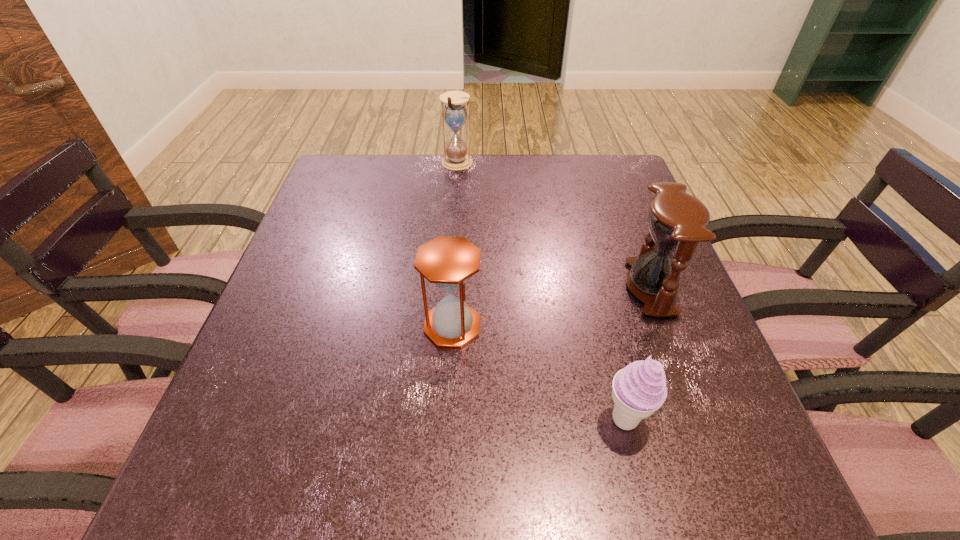
Image resolution: width=960 pixels, height=540 pixels. I want to click on hourglass at the right edge, so click(x=677, y=221).

Identify the location of icecream that is positioned at the right edge. The width and height of the screenshot is (960, 540). (639, 389).

Where is `free location at the far edge of the desktop`? free location at the far edge of the desktop is located at coordinates (412, 162).

In the image, there is a desktop. Where is `vacant space at the near edge`? The height and width of the screenshot is (540, 960). vacant space at the near edge is located at coordinates (388, 465).

In the image, there is a desktop. Where is `free space at the left edge`? The height and width of the screenshot is (540, 960). free space at the left edge is located at coordinates (346, 273).

This screenshot has height=540, width=960. Identify the location of free region at the right edge. [x=717, y=381].

You are a GUI agent. You are given a task and a screenshot of the screen. Output one action in this format:
    pyautogui.click(x=<x>, y=<y>)
    Task: Click on the free space at the far left corner of the desktop
    
    Given the screenshot: What is the action you would take?
    pyautogui.click(x=324, y=190)

This screenshot has width=960, height=540. What are the coordinates of `vacant space at the near left corner` in the screenshot? It's located at (295, 488).

In the image, there is a desktop. Where is `vacant area at the far right corner`? Image resolution: width=960 pixels, height=540 pixels. vacant area at the far right corner is located at coordinates (600, 165).

Where is `free spot between the shortest hourglass and the second object from right to left`? free spot between the shortest hourglass and the second object from right to left is located at coordinates (540, 373).